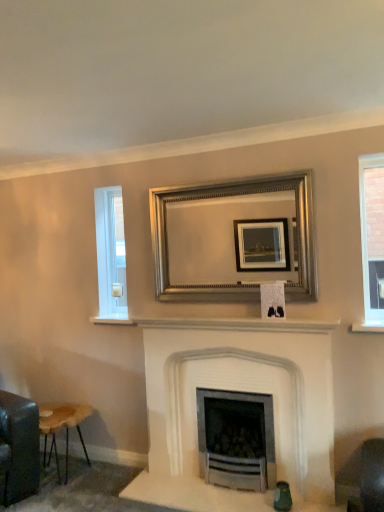
Where is `empty space that is ontop of silver/golden metallic picture frame at center (from a real-world perspective)`? Image resolution: width=384 pixels, height=512 pixels. empty space that is ontop of silver/golden metallic picture frame at center (from a real-world perspective) is located at coordinates (233, 179).